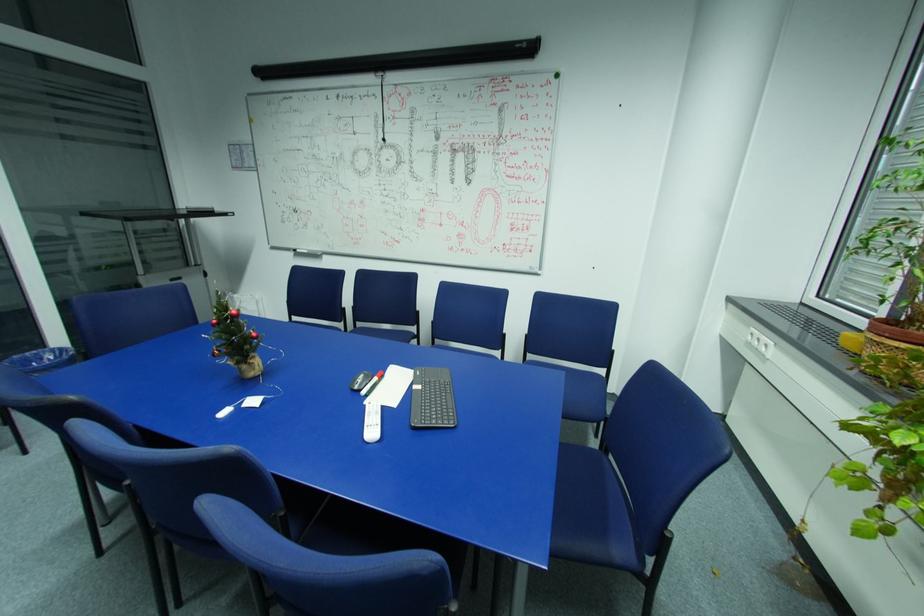
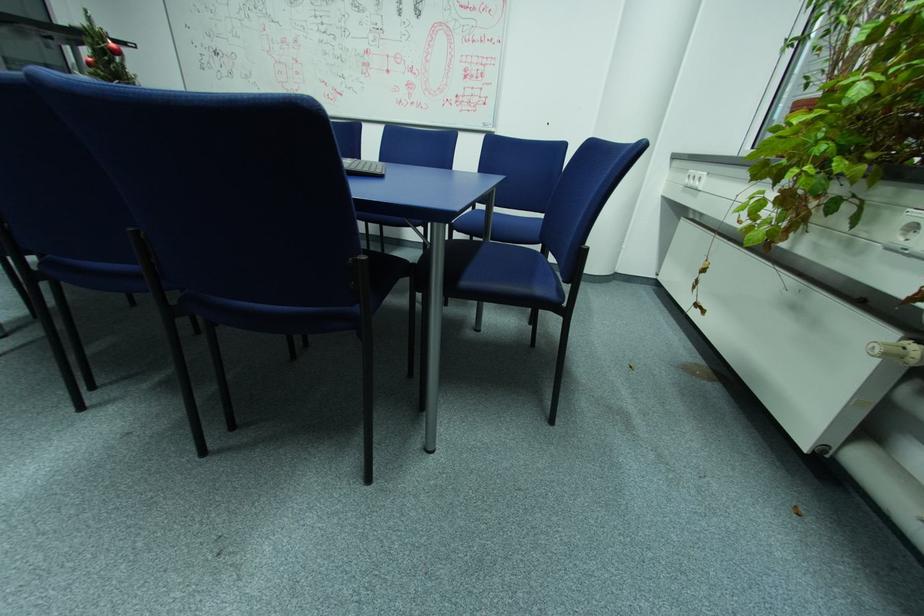
Question: The first image is from the beginning of the video and the second image is from the end. How did the camera likely rotate when shooting the video?

Choices:
 (A) Left
 (B) Right
 (C) Up
 (D) Down

Answer: (D)